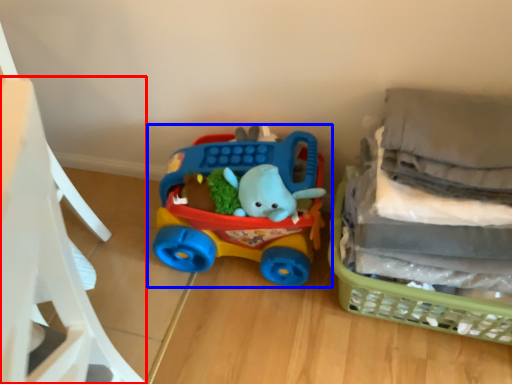
Question: Which object is closer to the camera taking this photo, chair (highlighted by a red box) or toy (highlighted by a blue box)?

Choices:
 (A) chair
 (B) toy

Answer: (A)